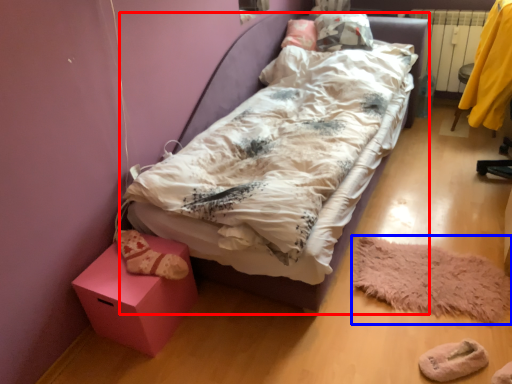
Question: Which of the following is the closest to the observer, bed (highlighted by a red box) or mat (highlighted by a blue box)?

Choices:
 (A) bed
 (B) mat

Answer: (A)